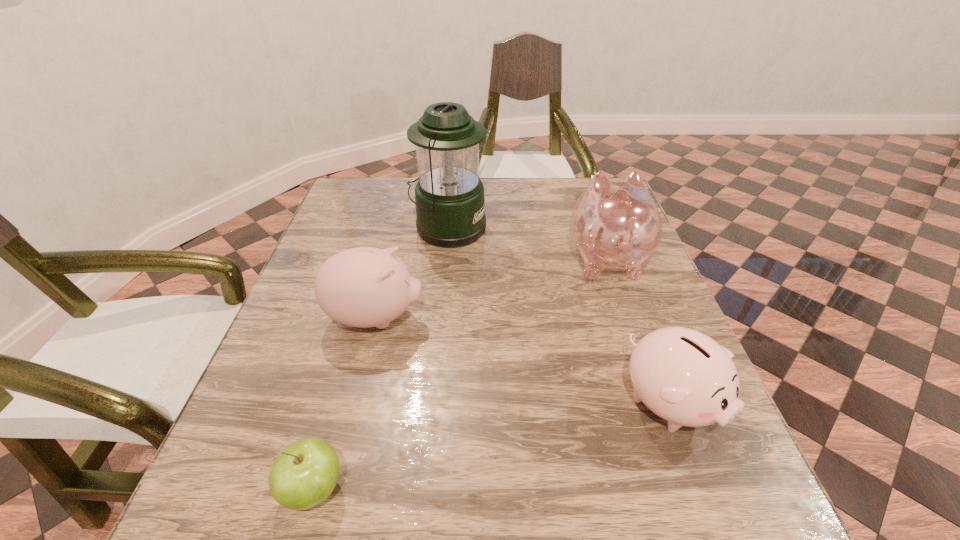
Where is `vacant space that satisfies the following two spatial constraints: 1. at the snout of the fourth farthest object; 2. on the left side of the leftmost piggy bank`? vacant space that satisfies the following two spatial constraints: 1. at the snout of the fourth farthest object; 2. on the left side of the leftmost piggy bank is located at coordinates (355, 402).

Where is `vacant space that satisfies the following two spatial constraints: 1. at the snout of the second farthest piggy bank; 2. on the right side of the nearest piggy bank`? Image resolution: width=960 pixels, height=540 pixels. vacant space that satisfies the following two spatial constraints: 1. at the snout of the second farthest piggy bank; 2. on the right side of the nearest piggy bank is located at coordinates (355, 402).

Locate an element on the screen. vacant space that satisfies the following two spatial constraints: 1. at the snout of the third nearest object; 2. on the left side of the second nearest object is located at coordinates (355, 402).

You are a GUI agent. You are given a task and a screenshot of the screen. Output one action in this format:
    pyautogui.click(x=<x>, y=<y>)
    Task: Click on the vacant space that satisfies the following two spatial constraints: 1. on the back side of the nearest piggy bank; 2. on the right side of the apple
    The width and height of the screenshot is (960, 540).
    Given the screenshot: What is the action you would take?
    pyautogui.click(x=338, y=402)

This screenshot has height=540, width=960. I want to click on vacant space that satisfies the following two spatial constraints: 1. on the front side of the lantern; 2. at the snout of the third farthest object, so click(440, 318).